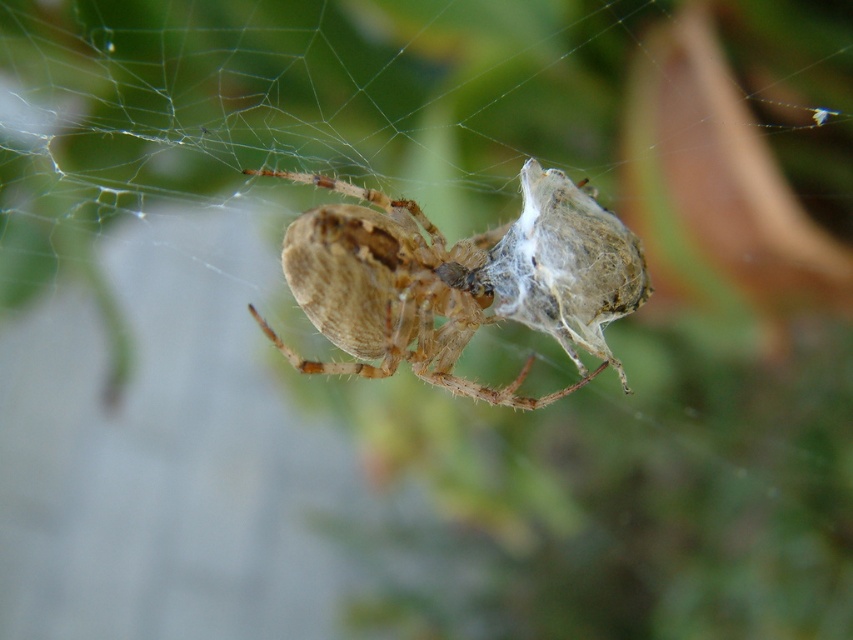
You are an entomologist observing a spider and its web. You notice the translucent silk web at center and the brown fuzzy spider at center. Which object is taller?

The translucent silk web at center is taller than the brown fuzzy spider at center.